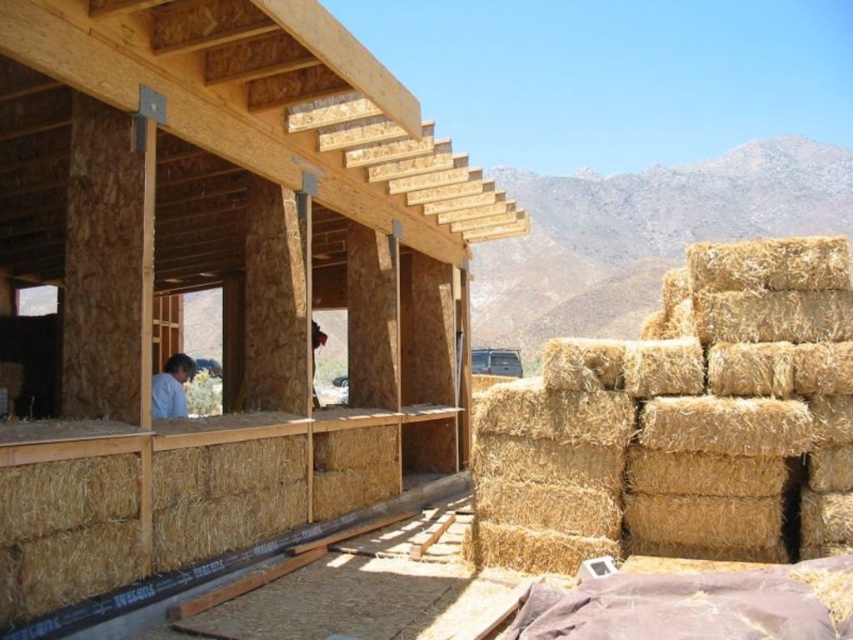
Question: Does natural straw bales at right appear on the left side of light blue shirt at lower left?

Choices:
 (A) yes
 (B) no

Answer: (B)

Question: Which point appears closest to the camera in this image?

Choices:
 (A) (154, 378)
 (B) (471, 456)
 (C) (289, 212)

Answer: (B)

Question: Which is nearer to the natural straw bales at right?

Choices:
 (A) yellow straw bales at right
 (B) light blue shirt at lower left

Answer: (B)

Question: Is natural straw bales at right further to camera compared to light blue shirt at lower left?

Choices:
 (A) yes
 (B) no

Answer: (B)

Question: From the image, what is the correct spatial relationship of natural straw bales at right in relation to yellow straw bales at right?

Choices:
 (A) right
 (B) left

Answer: (B)

Question: Which point is farther to the camera?

Choices:
 (A) (810, 374)
 (B) (167, 396)
 (C) (161, 564)

Answer: (B)